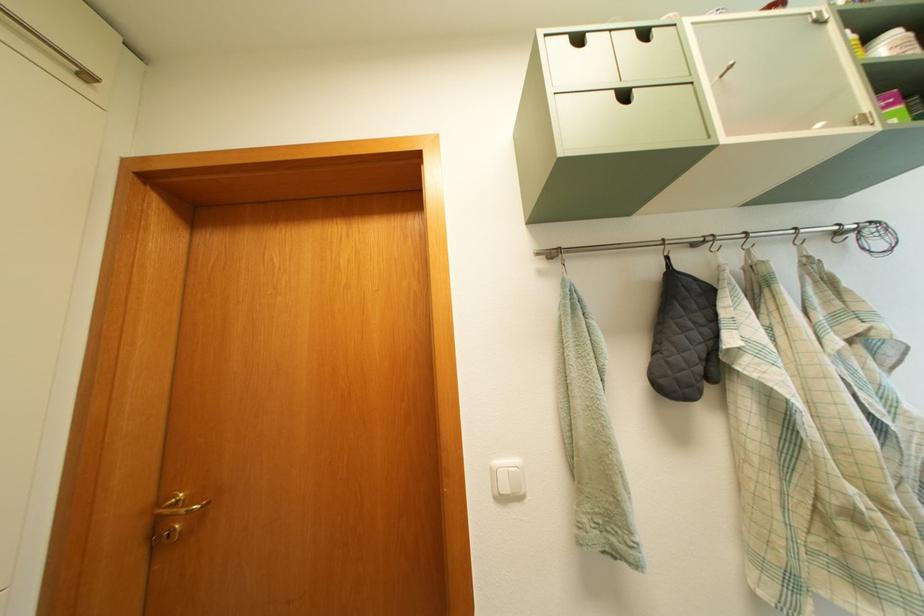
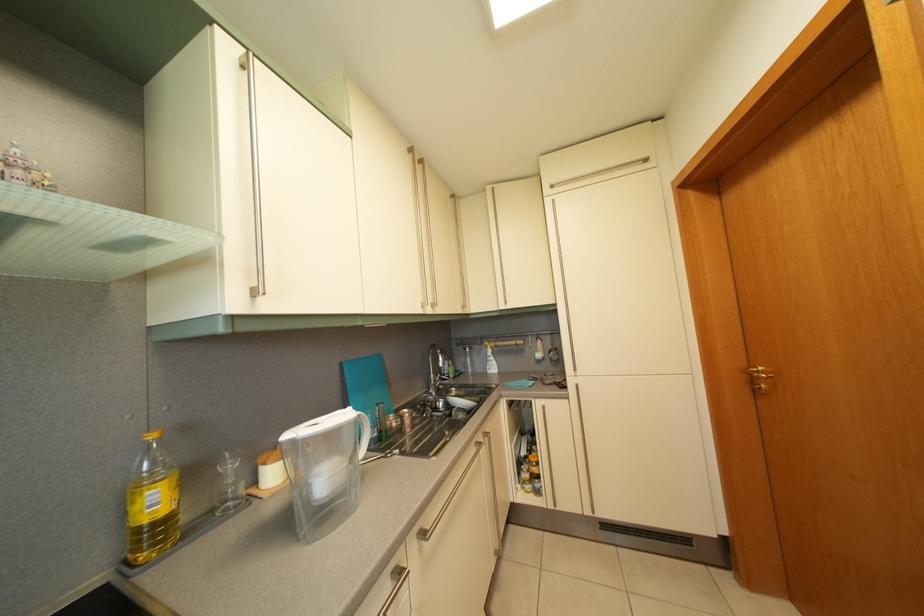
Question: The first image is from the beginning of the video and the second image is from the end. How did the camera likely rotate when shooting the video?

Choices:
 (A) Left
 (B) Right
 (C) Up
 (D) Down

Answer: (A)